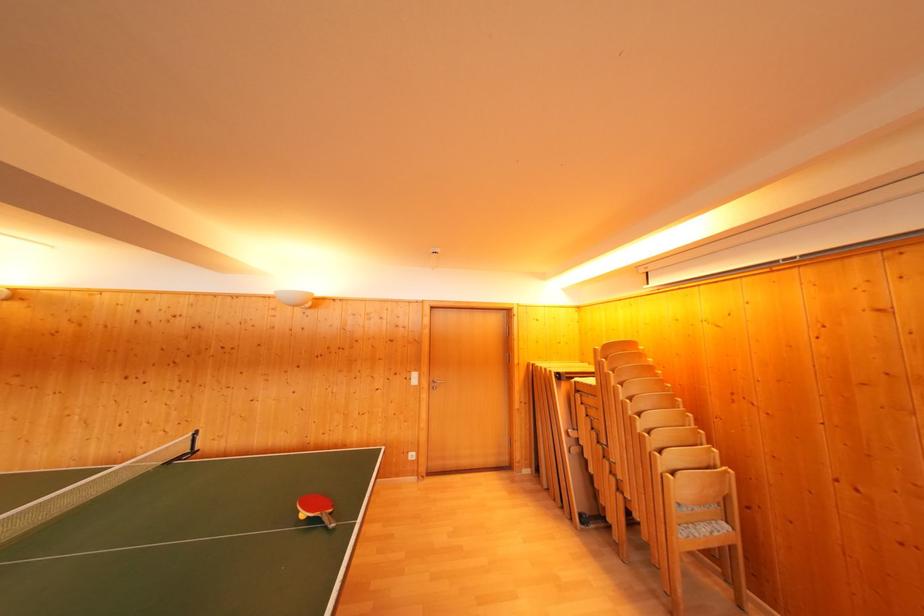
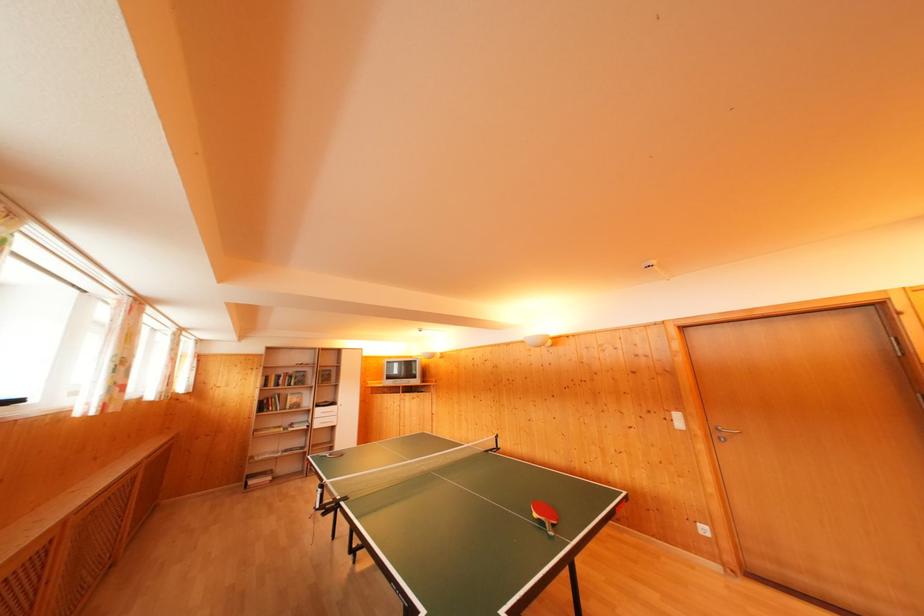
Find the pixel in the second image that matches (x=419, y=379) in the first image.

(682, 421)